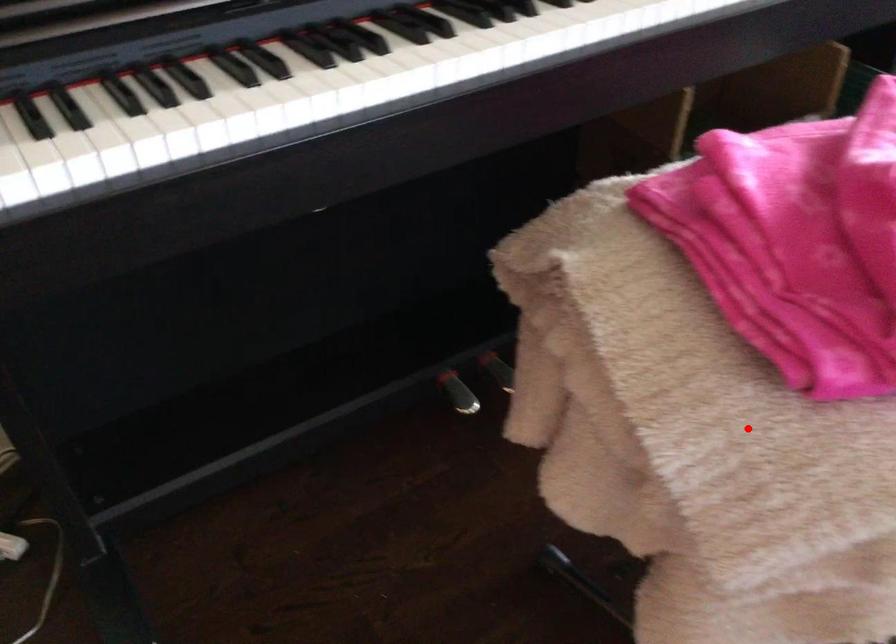
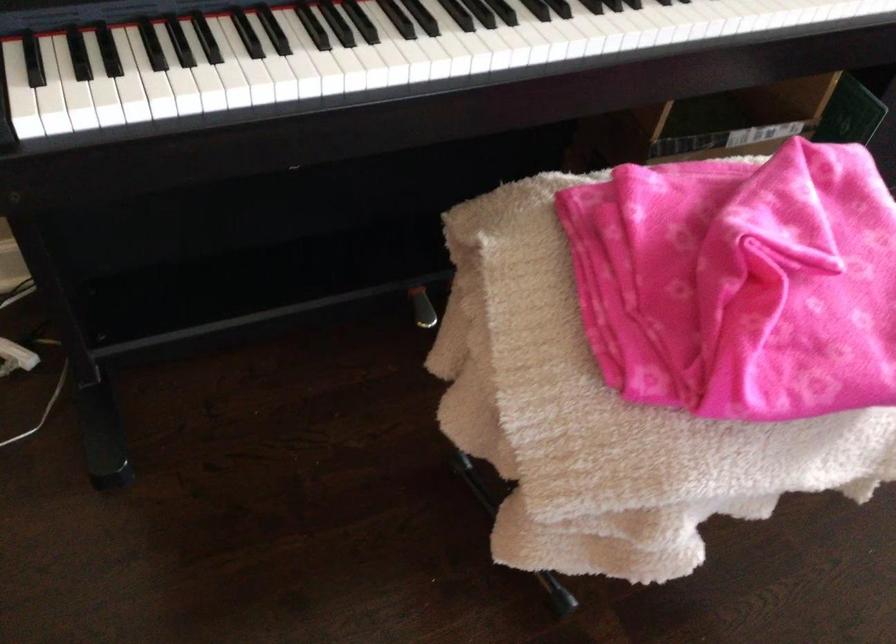
In the second image, find the point that corresponds to the highlighted location in the first image.

(571, 406)